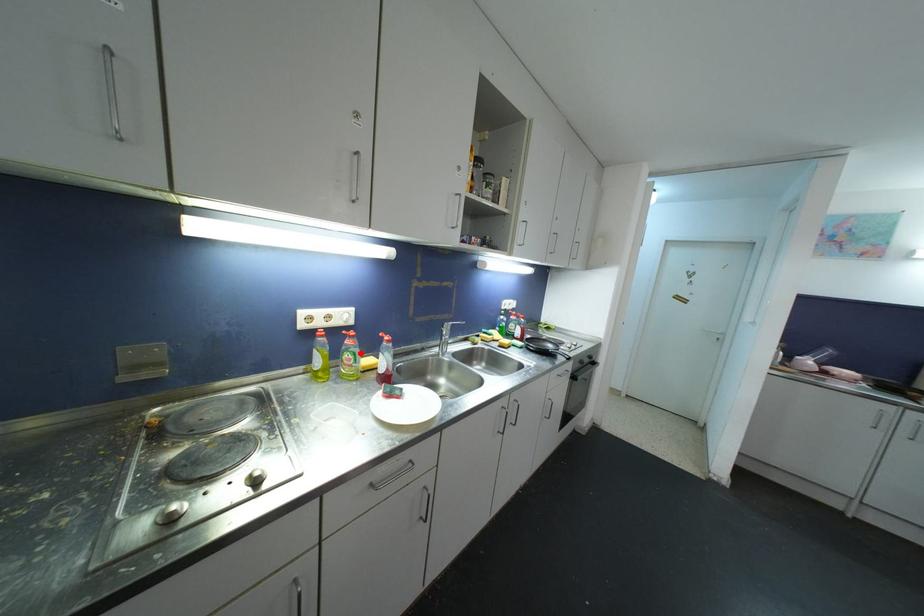
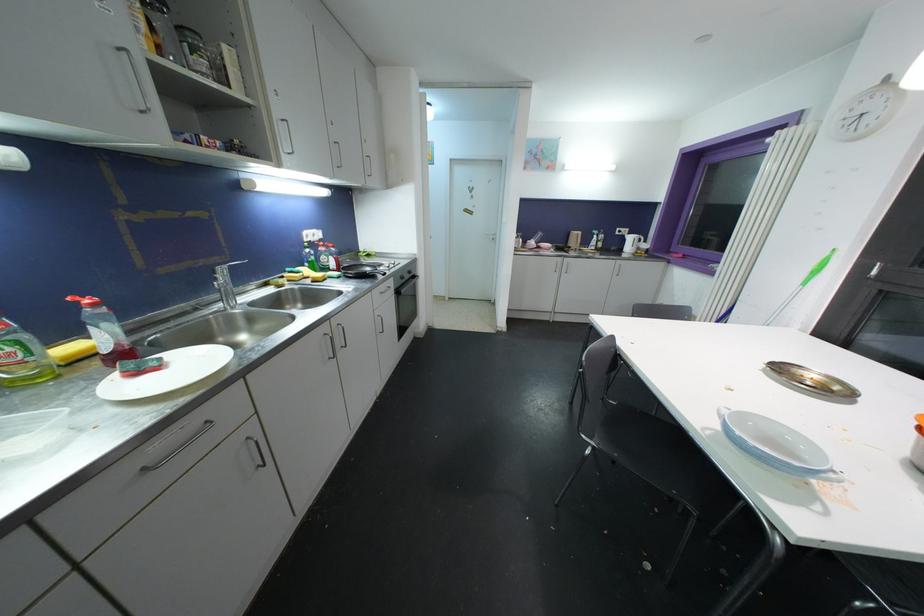
In the second image, find the point that corresponds to the highlighted location in the first image.

(27, 339)